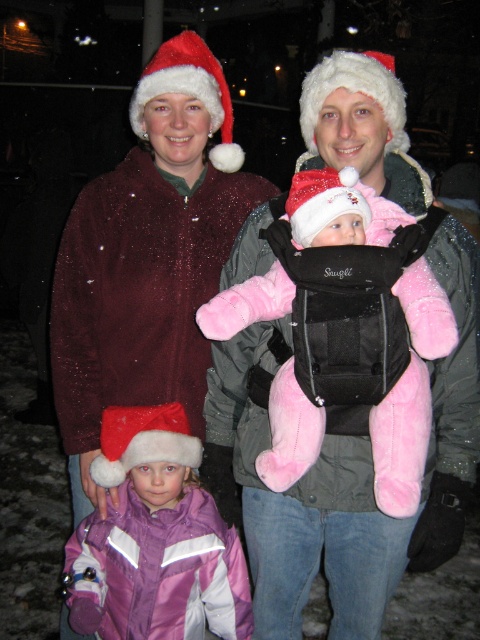
Question: Among these points, which one is nearest to the camera?

Choices:
 (A) (140, 500)
 (B) (204, 193)
 (C) (324, 211)

Answer: (C)

Question: Which object is farther from the camera taking this photo?

Choices:
 (A) pink plush baby at center
 (B) sparkly maroon coat at center
 (C) pink plush baby carrier at center

Answer: (B)

Question: Does pink plush baby carrier at center lie in front of pink plush baby at center?

Choices:
 (A) no
 (B) yes

Answer: (B)

Question: From the image, what is the correct spatial relationship of pink plush baby carrier at center in relation to pink plush baby at center?

Choices:
 (A) left
 (B) right

Answer: (B)

Question: Does pink plush baby carrier at center have a smaller size compared to pink plush baby at center?

Choices:
 (A) yes
 (B) no

Answer: (B)

Question: Which point is closer to the camera taking this photo?

Choices:
 (A) (315, 300)
 (B) (169, 595)

Answer: (A)